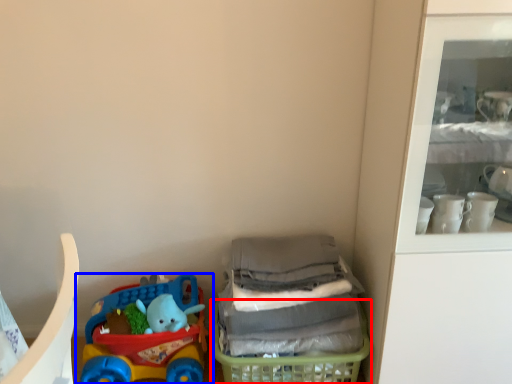
Question: Which point is closer to the camera, basket (highlighted by a red box) or toy (highlighted by a blue box)?

Choices:
 (A) basket
 (B) toy

Answer: (A)